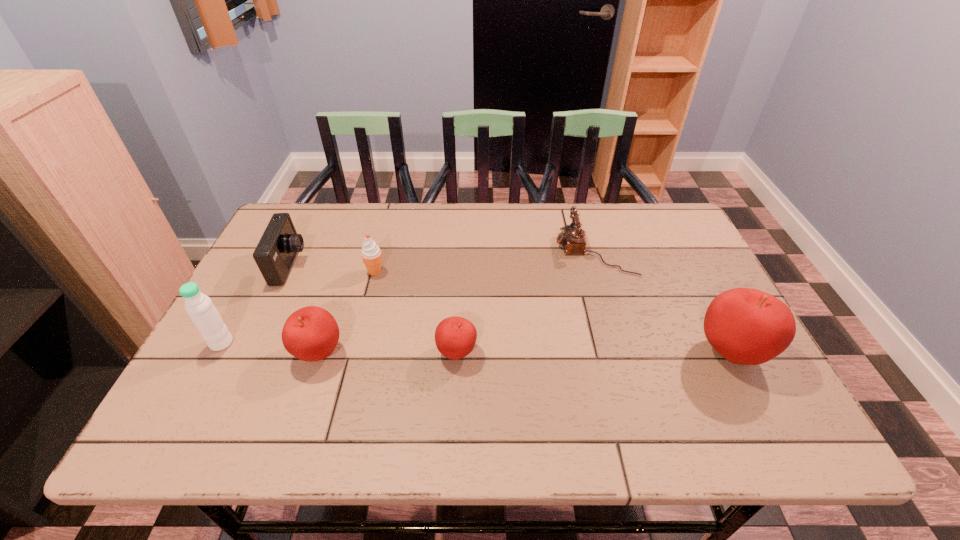
Image resolution: width=960 pixels, height=540 pixels. In order to click on vacant region that satisfies the following two spatial constraints: 1. on the back side of the second shortest apple; 2. on the front-facing side of the camera in this screenshot , I will do (x=348, y=266).

The image size is (960, 540). Identify the location of vacant region that satisfies the following two spatial constraints: 1. on the dial of the sixth object from left to right; 2. on the left side of the rightmost object. (624, 352).